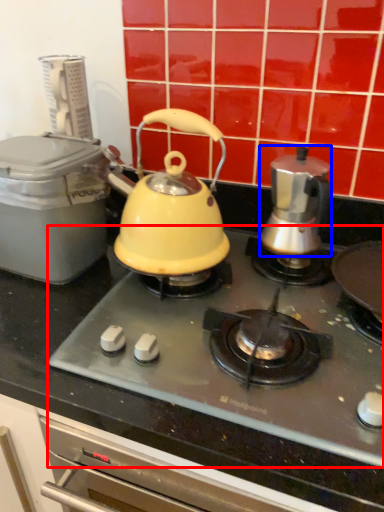
Question: Which of the following is the closest to the observer, gas stove (highlighted by a red box) or kettle (highlighted by a blue box)?

Choices:
 (A) gas stove
 (B) kettle

Answer: (A)